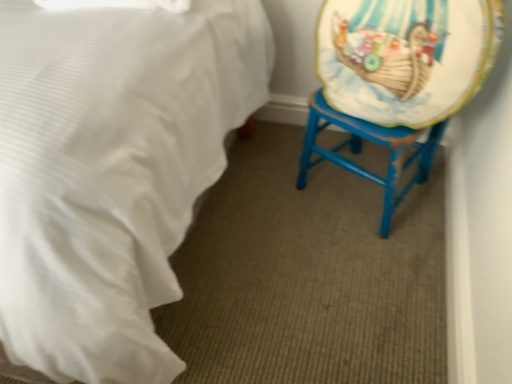
Question: Should I look upward or downward to see white satin bed at lower left?

Choices:
 (A) up
 (B) down

Answer: (A)

Question: Does blue painted wood swivel chair at right have a larger size compared to white satin bed at lower left?

Choices:
 (A) yes
 (B) no

Answer: (B)

Question: From the image's perspective, is blue painted wood swivel chair at right located above white satin bed at lower left?

Choices:
 (A) no
 (B) yes

Answer: (A)

Question: Does blue painted wood swivel chair at right contain white satin bed at lower left?

Choices:
 (A) no
 (B) yes

Answer: (A)

Question: Is there a large distance between blue painted wood swivel chair at right and white satin bed at lower left?

Choices:
 (A) no
 (B) yes

Answer: (A)

Question: Is blue painted wood swivel chair at right to the left of white satin bed at lower left from the viewer's perspective?

Choices:
 (A) yes
 (B) no

Answer: (B)

Question: Is blue painted wood swivel chair at right located outside white satin bed at lower left?

Choices:
 (A) yes
 (B) no

Answer: (A)

Question: Is blue painted wood swivel chair at right to the right of matte plastic platter at right from the viewer's perspective?

Choices:
 (A) yes
 (B) no

Answer: (A)

Question: Can we say blue painted wood swivel chair at right lies outside matte plastic platter at right?

Choices:
 (A) no
 (B) yes

Answer: (A)

Question: Does blue painted wood swivel chair at right have a greater width compared to matte plastic platter at right?

Choices:
 (A) no
 (B) yes

Answer: (B)

Question: From a real-world perspective, is blue painted wood swivel chair at right positioned under matte plastic platter at right based on gravity?

Choices:
 (A) no
 (B) yes

Answer: (B)

Question: Is blue painted wood swivel chair at right oriented away from matte plastic platter at right?

Choices:
 (A) yes
 (B) no

Answer: (A)

Question: Can you see blue painted wood swivel chair at right touching matte plastic platter at right?

Choices:
 (A) no
 (B) yes

Answer: (B)

Question: Considering the relative sizes of matte plastic platter at right and blue painted wood swivel chair at right in the image provided, is matte plastic platter at right shorter than blue painted wood swivel chair at right?

Choices:
 (A) no
 (B) yes

Answer: (B)